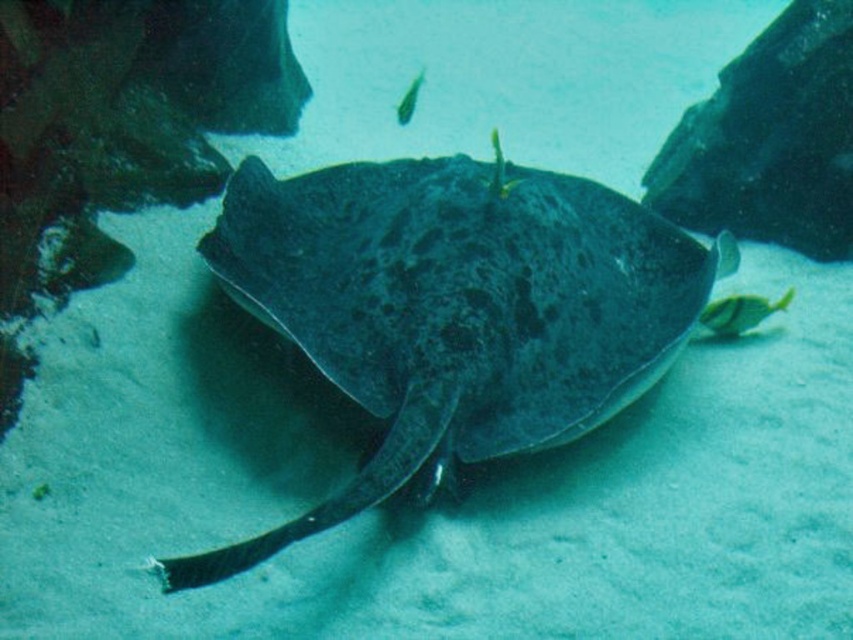
Question: Is dark gray textured stingray at center positioned before shiny yellow fish at center?

Choices:
 (A) yes
 (B) no

Answer: (A)

Question: Is dark gray textured stingray at center to the left of green glossy fish at upper center from the viewer's perspective?

Choices:
 (A) no
 (B) yes

Answer: (A)

Question: Which object appears closest to the camera in this image?

Choices:
 (A) dark gray textured stingray at center
 (B) green glossy fish at upper center

Answer: (A)

Question: Among these objects, which one is farthest from the camera?

Choices:
 (A) green glossy fish at upper center
 (B) shiny yellow fish at center

Answer: (A)

Question: Is the position of shiny yellow fish at center less distant than that of green glossy fish at upper center?

Choices:
 (A) yes
 (B) no

Answer: (A)

Question: Which of the following is the farthest from the observer?

Choices:
 (A) shiny yellow fish at center
 (B) dark gray textured stingray at center
 (C) green glossy fish at upper center

Answer: (C)